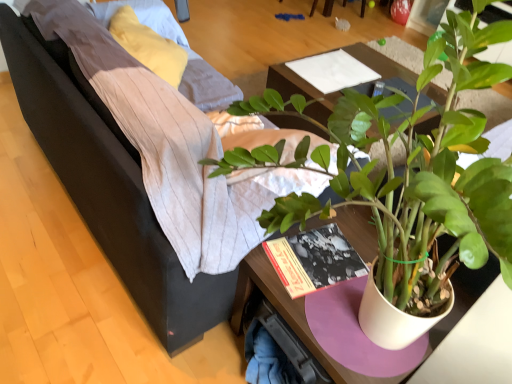
This screenshot has height=384, width=512. Describe the element at coordinates (423, 170) in the screenshot. I see `green matte plant at center` at that location.

You are a GUI agent. You are given a task and a screenshot of the screen. Output one action in this format:
    pyautogui.click(x=<x>, y=<y>)
    Task: Click on the white paper at center
    
    Given the screenshot: What is the action you would take?
    click(x=333, y=71)

This screenshot has width=512, height=384. Describe the element at coordinates (301, 92) in the screenshot. I see `wooden table at center` at that location.

At what (x,y) coordinates should I click in order to perform the action: click on green matte plant at center. Please return your answer as a coordinate pair (x, y). Looking at the image, I should click on (423, 170).

Do you think dark gray fabric couch at center is within green matte plant at center, or outside of it?

dark gray fabric couch at center exists outside the volume of green matte plant at center.

Consider the image. Could you tell me if dark gray fabric couch at center is turned towards green matte plant at center?

No, dark gray fabric couch at center does not turn towards green matte plant at center.

From the image's perspective, which one is positioned lower, dark gray fabric couch at center or green matte plant at center?

green matte plant at center.

Is the depth of dark gray fabric couch at center greater than that of green matte plant at center?

Yes.

Considering the relative sizes of green matte plant at center and wooden table at center in the image provided, is green matte plant at center smaller than wooden table at center?

Incorrect, green matte plant at center is not smaller in size than wooden table at center.

From a real-world perspective, is green matte plant at center located higher than wooden table at center?

Yes, from a real-world perspective, green matte plant at center is above wooden table at center.

Could you tell me if green matte plant at center is facing wooden table at center?

No, green matte plant at center is not turned towards wooden table at center.

Considering the sizes of objects wooden table at center and green matte plant at center in the image provided, who is thinner, wooden table at center or green matte plant at center?

Thinner between the two is wooden table at center.

From a real-world perspective, which object stands above the other?

green matte plant at center is physically above.

Are wooden table at center and green matte plant at center located far from each other?

wooden table at center is near green matte plant at center, not far away.

Where is `table behind the green matte plant at center`? The width and height of the screenshot is (512, 384). table behind the green matte plant at center is located at coordinates (301, 92).

Is wooden table at center oriented towards white paper at center?

No, wooden table at center is not aimed at white paper at center.

Would you consider wooden table at center to be distant from white paper at center?

No.

Would you say wooden table at center is to the left or to the right of white paper at center in the picture?

Clearly, wooden table at center is on the right of white paper at center in the image.

Based on the photo, is wooden table at center behind white paper at center?

No.

From the picture: How many degrees apart are the facing directions of green matte plant at center and dark gray fabric couch at center?

The angle between the facing direction of green matte plant at center and the facing direction of dark gray fabric couch at center is 0.000202 degrees.

Which of these two, green matte plant at center or dark gray fabric couch at center, stands taller?

With more height is green matte plant at center.

From the image's perspective, is green matte plant at center on dark gray fabric couch at center?

No, from the image's perspective, green matte plant at center is not on top of dark gray fabric couch at center.

Considering the relative sizes of wooden table at center and dark gray fabric couch at center in the image provided, is wooden table at center shorter than dark gray fabric couch at center?

Yes.

Is wooden table at center closer to camera compared to dark gray fabric couch at center?

No.

Between wooden table at center and dark gray fabric couch at center, which one has larger width?

dark gray fabric couch at center is wider.

Which is correct: dark gray fabric couch at center is inside white paper at center, or outside of it?

dark gray fabric couch at center is not inside white paper at center, it's outside.

From the image's perspective, is dark gray fabric couch at center positioned above or below white paper at center?

Based on their image positions, dark gray fabric couch at center is located beneath white paper at center.

How many degrees apart are the facing directions of dark gray fabric couch at center and white paper at center?

They differ by 86 degrees in their facing directions.

Based on their sizes in the image, would you say dark gray fabric couch at center is bigger or smaller than white paper at center?

dark gray fabric couch at center is bigger than white paper at center.

The width and height of the screenshot is (512, 384). Find the location of `houseplant in front of the dark gray fabric couch at center`. houseplant in front of the dark gray fabric couch at center is located at coordinates (423, 170).

Locate an element on the screen. The image size is (512, 384). table lying behind the green matte plant at center is located at coordinates (301, 92).

From the image, which object appears to be farther from white paper at center, green matte plant at center or dark gray fabric couch at center?

The object further to white paper at center is dark gray fabric couch at center.

Considering their positions, is white paper at center positioned further to green matte plant at center than wooden table at center?

Among the two, white paper at center is located further to green matte plant at center.

Based on their spatial positions, is green matte plant at center or white paper at center closer to dark gray fabric couch at center?

green matte plant at center lies closer to dark gray fabric couch at center than the other object.

Estimate the real-world distances between objects in this image. Which object is closer to wooden table at center, white paper at center or green matte plant at center?

Among the two, white paper at center is located nearer to wooden table at center.

When comparing their distances from dark gray fabric couch at center, does green matte plant at center or wooden table at center seem further?

The object further to dark gray fabric couch at center is wooden table at center.

Considering their positions, is wooden table at center positioned closer to dark gray fabric couch at center than white paper at center?

The object closer to dark gray fabric couch at center is wooden table at center.

Looking at the image, which one is located closer to green matte plant at center, wooden table at center or white paper at center?

Among the two, wooden table at center is located nearer to green matte plant at center.

When comparing their distances from white paper at center, does green matte plant at center or wooden table at center seem further?

Based on the image, green matte plant at center appears to be further to white paper at center.

Image resolution: width=512 pixels, height=384 pixels. I want to click on table positioned between dark gray fabric couch at center and white paper at center from near to far, so click(301, 92).

Locate an element on the screen. studio couch between green matte plant at center and white paper at center in the front-back direction is located at coordinates (108, 186).

Locate an element on the screen. Image resolution: width=512 pixels, height=384 pixels. table between green matte plant at center and white paper at center from front to back is located at coordinates (301, 92).

At what (x,y) coordinates should I click in order to perform the action: click on studio couch located between green matte plant at center and wooden table at center in the depth direction. Please return your answer as a coordinate pair (x, y). The image size is (512, 384). Looking at the image, I should click on (108, 186).